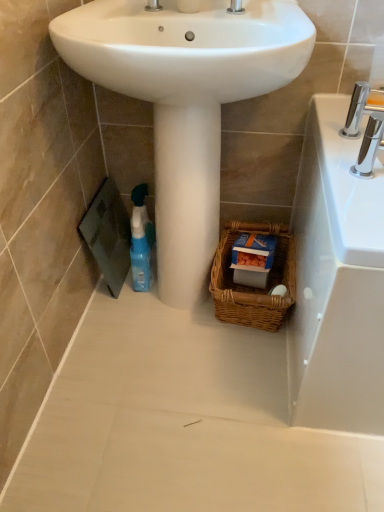
Where is `chrome metallic faucet at upper right`? This screenshot has width=384, height=512. chrome metallic faucet at upper right is located at coordinates (367, 125).

The width and height of the screenshot is (384, 512). I want to click on chrome metallic faucet at upper right, so click(x=367, y=125).

Is white glossy sink at center next to white smooth pedestal at center?

There is a gap between white glossy sink at center and white smooth pedestal at center.

How many degrees apart are the facing directions of white glossy sink at center and white smooth pedestal at center?

The angle between the facing direction of white glossy sink at center and the facing direction of white smooth pedestal at center is 0.000275 degrees.

In the scene shown: Measure the distance from white glossy sink at center to white smooth pedestal at center.

A distance of 9.63 inches exists between white glossy sink at center and white smooth pedestal at center.

From the image's perspective, which is below, white glossy sink at center or white smooth pedestal at center?

From the image's view, white smooth pedestal at center is below.

Can you confirm if woven brown basket at lower center is taller than chrome metallic faucet at upper right?

Correct, woven brown basket at lower center is much taller as chrome metallic faucet at upper right.

Is woven brown basket at lower center facing towards chrome metallic faucet at upper right?

No, woven brown basket at lower center is not facing towards chrome metallic faucet at upper right.

Is woven brown basket at lower center positioned far away from chrome metallic faucet at upper right?

woven brown basket at lower center is actually quite close to chrome metallic faucet at upper right.

Is point (268, 309) farther from viewer compared to point (362, 141)?

Yes, point (268, 309) is behind point (362, 141).

Between white glossy sink at center and woven brown basket at lower center, which one appears on the left side from the viewer's perspective?

white glossy sink at center.

From a real-world perspective, is white glossy sink at center positioned above or below woven brown basket at lower center?

white glossy sink at center is situated higher than woven brown basket at lower center in the real world.

Looking at this image, considering the sizes of white glossy sink at center and woven brown basket at lower center in the image, is white glossy sink at center taller or shorter than woven brown basket at lower center?

Clearly, white glossy sink at center is shorter compared to woven brown basket at lower center.

Is white glossy sink at center completely or partially outside of woven brown basket at lower center?

Yes, white glossy sink at center is located beyond the bounds of woven brown basket at lower center.

Is white smooth pedestal at center aimed at chrome metallic faucet at upper right?

No, white smooth pedestal at center is not turned towards chrome metallic faucet at upper right.

Between white smooth pedestal at center and chrome metallic faucet at upper right, which one has more height?

white smooth pedestal at center is taller.

Where is `tap above the white smooth pedestal at center (from the image's perspective)`? tap above the white smooth pedestal at center (from the image's perspective) is located at coordinates (367, 125).

Can you confirm if white smooth pedestal at center is positioned to the right of chrome metallic faucet at upper right?

No.

From a real-world perspective, between blue plastic spray bottle at lower left and white glossy sink at center, who is vertically higher?

In real-world perspective, white glossy sink at center is above.

In terms of height, does blue plastic spray bottle at lower left look taller or shorter compared to white glossy sink at center?

In the image, blue plastic spray bottle at lower left appears to be taller than white glossy sink at center.

Is blue plastic spray bottle at lower left bigger than white glossy sink at center?

No, blue plastic spray bottle at lower left is not bigger than white glossy sink at center.

What are the coordinates of `pillar behind the white glossy sink at center` in the screenshot? It's located at pyautogui.click(x=186, y=198).

In terms of width, does white smooth pedestal at center look wider or thinner when compared to white glossy sink at center?

Clearly, white smooth pedestal at center has less width compared to white glossy sink at center.

Would you consider white smooth pedestal at center to be distant from white glossy sink at center?

No, white smooth pedestal at center is in close proximity to white glossy sink at center.

Based on the photo, from a real-world perspective, is white smooth pedestal at center located higher than white glossy sink at center?

No.

Would you say chrome metallic faucet at upper right is a long distance from white glossy sink at center?

chrome metallic faucet at upper right is actually quite close to white glossy sink at center.

How much distance is there between chrome metallic faucet at upper right and white glossy sink at center?

chrome metallic faucet at upper right is 15.53 inches from white glossy sink at center.

In the scene shown: From the image's perspective, would you say chrome metallic faucet at upper right is shown under white glossy sink at center?

Yes, from the image's perspective, chrome metallic faucet at upper right is below white glossy sink at center.

What's the angular difference between chrome metallic faucet at upper right and white glossy sink at center's facing directions?

chrome metallic faucet at upper right and white glossy sink at center are facing 90.1 degrees away from each other.

The height and width of the screenshot is (512, 384). What are the coordinates of `pillar behind the white glossy sink at center` in the screenshot? It's located at pyautogui.click(x=186, y=198).

In the image, there is a chrome metallic faucet at upper right. Where is `basket below it (from a real-world perspective)`? The image size is (384, 512). basket below it (from a real-world perspective) is located at coordinates coord(253,287).

Considering their positions, is white smooth pedestal at center positioned further to blue plastic spray bottle at lower left than woven brown basket at lower center?

Among the two, woven brown basket at lower center is located further to blue plastic spray bottle at lower left.

Consider the image. From the image, which object appears to be nearer to chrome metallic faucet at upper right, blue plastic spray bottle at lower left or white smooth pedestal at center?

white smooth pedestal at center.

Which object lies further to the anchor point chrome metallic faucet at upper right, woven brown basket at lower center or white smooth pedestal at center?

woven brown basket at lower center is further to chrome metallic faucet at upper right.

Looking at the image, which one is located closer to woven brown basket at lower center, blue plastic spray bottle at lower left or white glossy sink at center?

Among the two, blue plastic spray bottle at lower left is located nearer to woven brown basket at lower center.

Estimate the real-world distances between objects in this image. Which object is closer to white glossy sink at center, chrome metallic faucet at upper right or woven brown basket at lower center?

chrome metallic faucet at upper right is positioned closer to the anchor white glossy sink at center.

Estimate the real-world distances between objects in this image. Which object is closer to white glossy sink at center, white smooth pedestal at center or blue plastic spray bottle at lower left?

Among the two, white smooth pedestal at center is located nearer to white glossy sink at center.

Which object lies nearer to the anchor point blue plastic spray bottle at lower left, woven brown basket at lower center or chrome metallic faucet at upper right?

woven brown basket at lower center is closer to blue plastic spray bottle at lower left.

When comparing their distances from blue plastic spray bottle at lower left, does white smooth pedestal at center or chrome metallic faucet at upper right seem further?

The object further to blue plastic spray bottle at lower left is chrome metallic faucet at upper right.

This screenshot has width=384, height=512. I want to click on tap that lies between white glossy sink at center and woven brown basket at lower center from top to bottom, so click(367, 125).

This screenshot has width=384, height=512. What are the coordinates of `basket between white smooth pedestal at center and chrome metallic faucet at upper right in the horizontal direction` in the screenshot? It's located at (253, 287).

You are a GUI agent. You are given a task and a screenshot of the screen. Output one action in this format:
    pyautogui.click(x=<x>, y=<y>)
    Task: Click on the pillar between blue plastic spray bottle at lower left and chrome metallic faucet at upper right in the horizontal direction
    This screenshot has width=384, height=512.
    Given the screenshot: What is the action you would take?
    pyautogui.click(x=186, y=198)

This screenshot has width=384, height=512. I want to click on pillar between white glossy sink at center and chrome metallic faucet at upper right, so click(x=186, y=198).